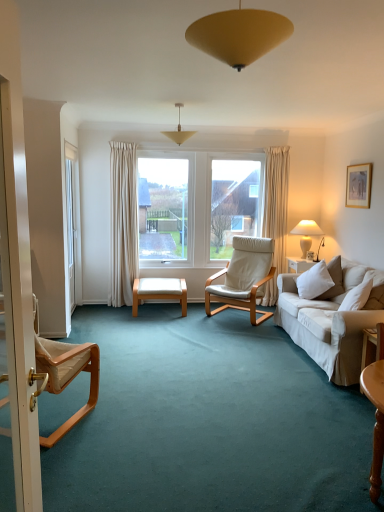
Identify the location of spots to the right of light brown wood chair at left, the 2th chair in the right-to-left sequence. Image resolution: width=384 pixels, height=512 pixels. (132, 432).